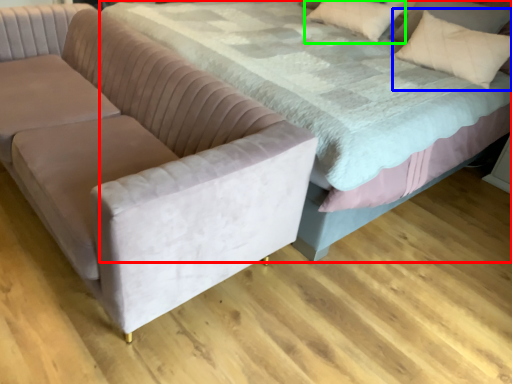
Question: Based on their relative distances, which object is farther from bed (highlighted by a red box)? Choose from throw pillow (highlighted by a blue box) and pillow (highlighted by a green box).

Choices:
 (A) throw pillow
 (B) pillow

Answer: (B)